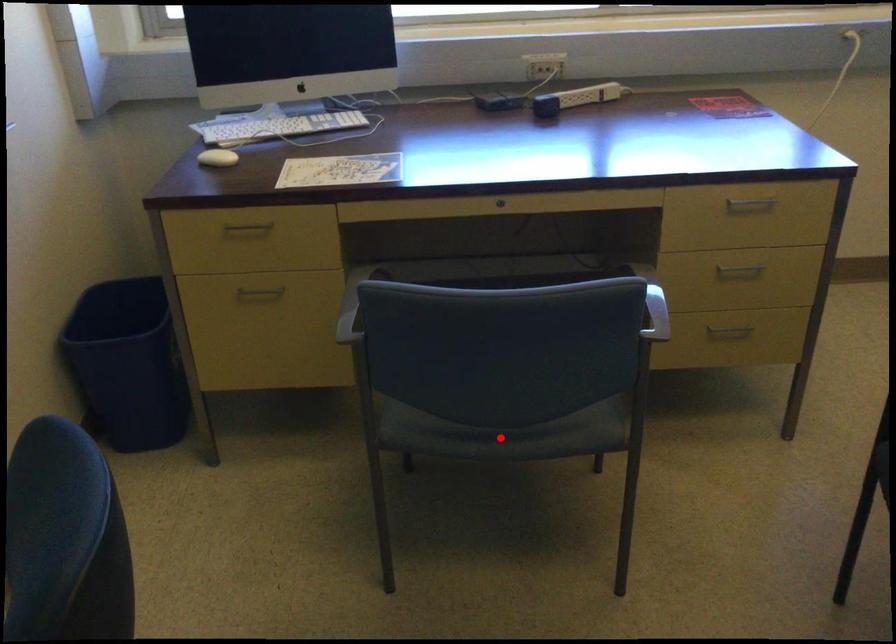
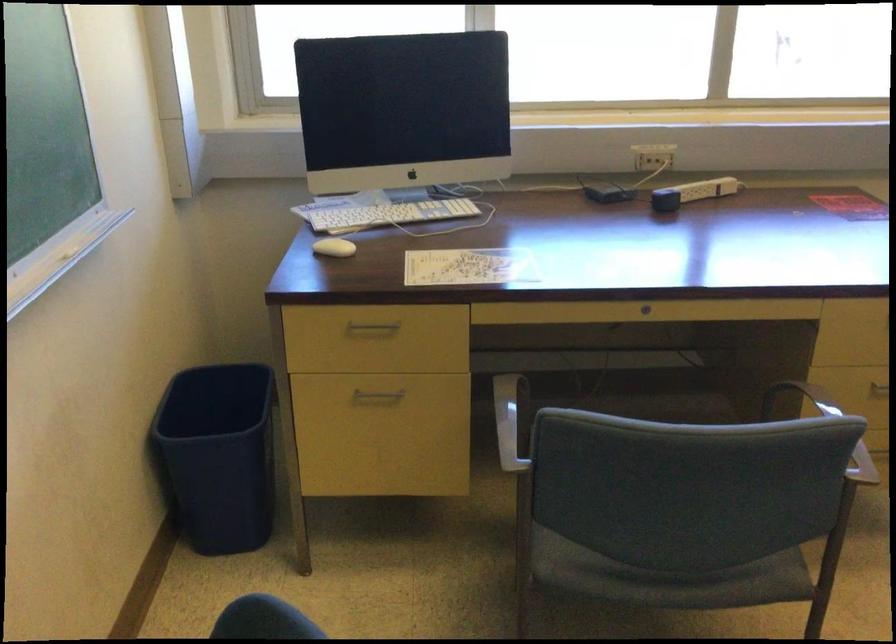
The point at the highlighted location is marked in the first image. Where is the corresponding point in the second image?

(668, 578)